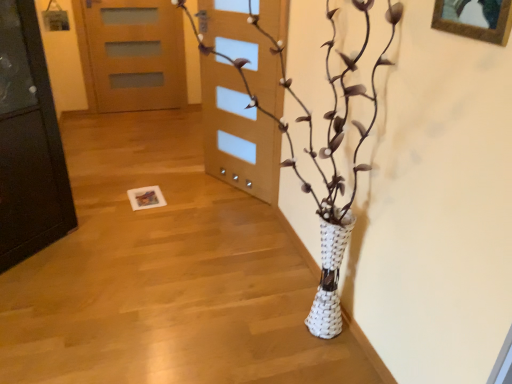
Question: Does wooden door at upper center have a lesser height compared to wooden picture frame at upper right?

Choices:
 (A) no
 (B) yes

Answer: (A)

Question: Is wooden picture frame at upper right completely or partially inside wooden door at upper center?

Choices:
 (A) no
 (B) yes

Answer: (A)

Question: From a real-world perspective, is wooden door at upper center below wooden picture frame at upper right?

Choices:
 (A) yes
 (B) no

Answer: (A)

Question: From a real-world perspective, is wooden door at upper center physically above wooden picture frame at upper right?

Choices:
 (A) yes
 (B) no

Answer: (B)

Question: Does wooden door at upper center lie behind wooden picture frame at upper right?

Choices:
 (A) no
 (B) yes

Answer: (B)

Question: Is wooden door at upper center positioned far away from wooden picture frame at upper right?

Choices:
 (A) no
 (B) yes

Answer: (B)

Question: Considering the relative sizes of wooden picture frame at upper right and white woven vase at center in the image provided, is wooden picture frame at upper right wider than white woven vase at center?

Choices:
 (A) yes
 (B) no

Answer: (B)

Question: Is wooden picture frame at upper right aimed at white woven vase at center?

Choices:
 (A) no
 (B) yes

Answer: (B)

Question: From the image's perspective, is wooden picture frame at upper right located above white woven vase at center?

Choices:
 (A) yes
 (B) no

Answer: (A)

Question: Is wooden picture frame at upper right in contact with white woven vase at center?

Choices:
 (A) no
 (B) yes

Answer: (A)

Question: Considering the relative positions of wooden picture frame at upper right and white woven vase at center in the image provided, is wooden picture frame at upper right to the right of white woven vase at center from the viewer's perspective?

Choices:
 (A) no
 (B) yes

Answer: (B)

Question: Is wooden picture frame at upper right closer to the viewer compared to white woven vase at center?

Choices:
 (A) no
 (B) yes

Answer: (A)

Question: From the image's perspective, is white woven vase at center on top of wooden picture frame at upper right?

Choices:
 (A) yes
 (B) no

Answer: (B)